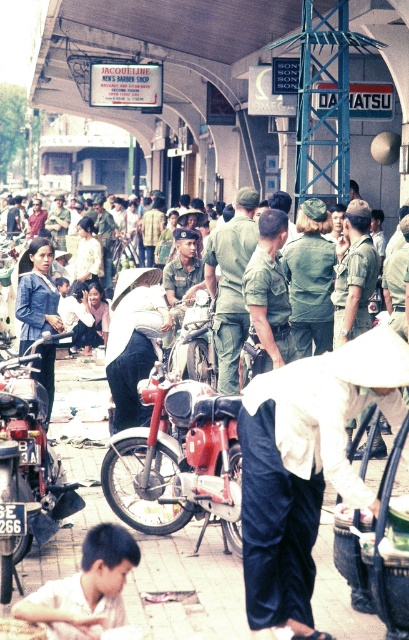
Which is in front, point (240, 193) or point (359, 324)?

Point (359, 324) is more forward.

Is green uniform at center to the right of green matte uniform at center from the viewer's perspective?

Incorrect, green uniform at center is not on the right side of green matte uniform at center.

Identify the location of green uniform at center. The width and height of the screenshot is (409, 640). (231, 284).

Is shiny chrome motorcycle at lower left closer to camera compared to green uniform at center?

Yes, it is.

Between shiny chrome motorcycle at lower left and green uniform at center, which one appears on the left side from the viewer's perspective?

Positioned to the left is shiny chrome motorcycle at lower left.

Is point (35, 500) in front of point (217, 365)?

Yes, point (35, 500) is closer to viewer.

I want to click on shiny chrome motorcycle at lower left, so click(29, 461).

Can you confirm if white cotton hat at center is positioned to the left of green military uniform at center?

Correct, you'll find white cotton hat at center to the left of green military uniform at center.

Between point (305, 541) and point (280, 344), which one is positioned behind?

Point (280, 344)

Is point (253, 554) closer to viewer compared to point (251, 336)?

Yes, it is.

Find the location of `white cotton hat at center`. white cotton hat at center is located at coordinates (305, 467).